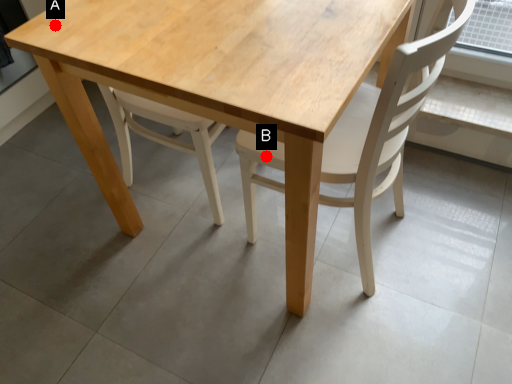
Question: Two points are circled on the image, labeled by A and B beside each circle. Which point is closer to the camera?

Choices:
 (A) A is closer
 (B) B is closer

Answer: (A)